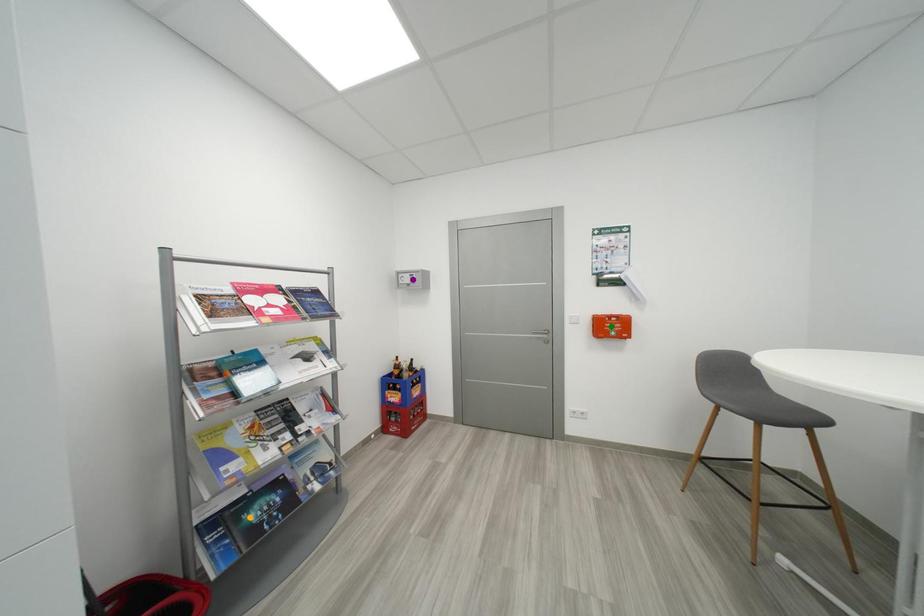
Order these from nearest to farthest:
1. orange point
2. purple point
3. green point

orange point
green point
purple point